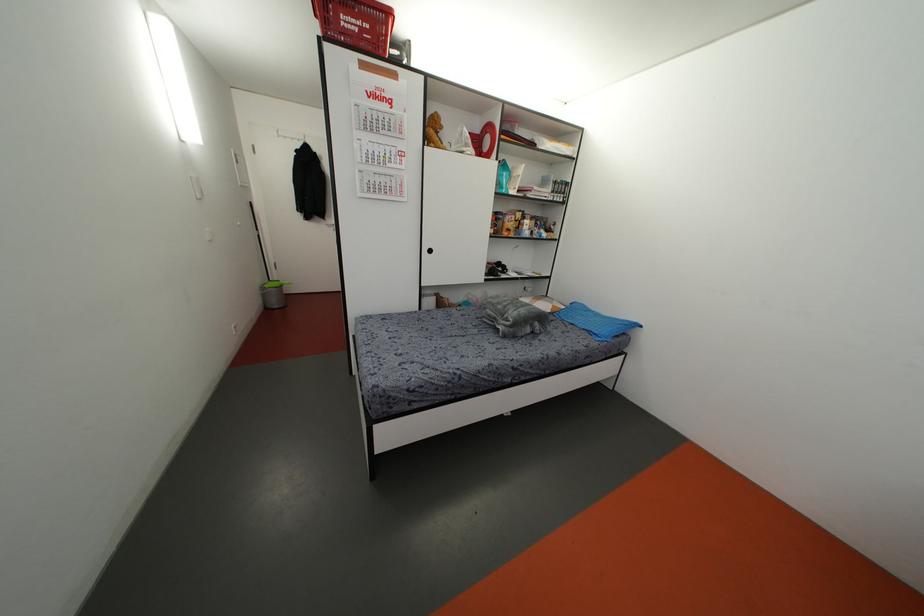
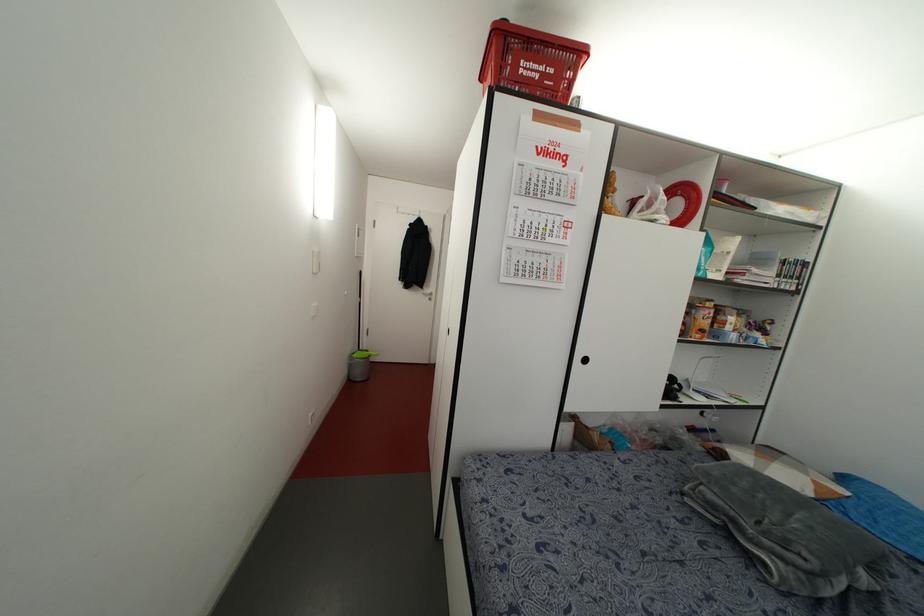
In a continuous first-person perspective shot, in which direction is the camera moving?

The movement direction of the cameraman is left, forward.